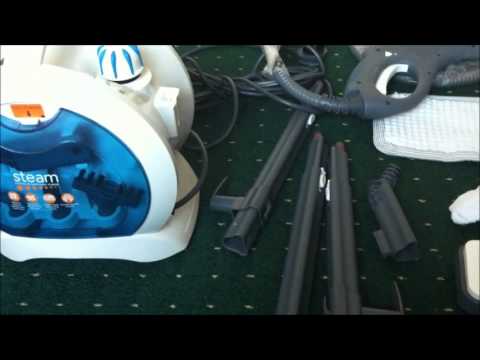
Find the location of a particular element. This screenshot has height=360, width=480. steam cleaner hose is located at coordinates (292, 86).